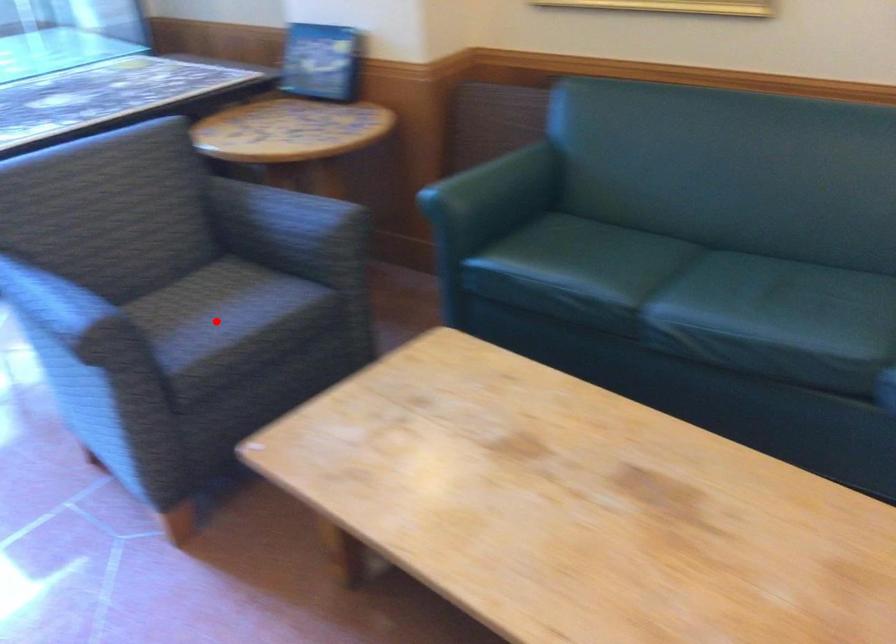
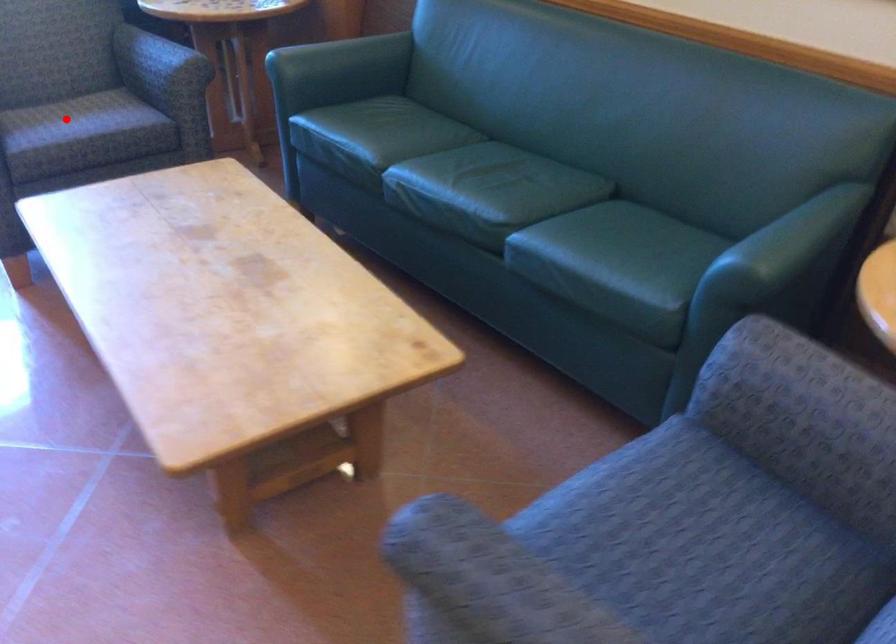
I am providing you with two images of the same scene from different viewpoints. A red point is marked on the first image and another point is marked on the second image. Do the highlighted points in image1 and image2 indicate the same real-world spot?

Yes